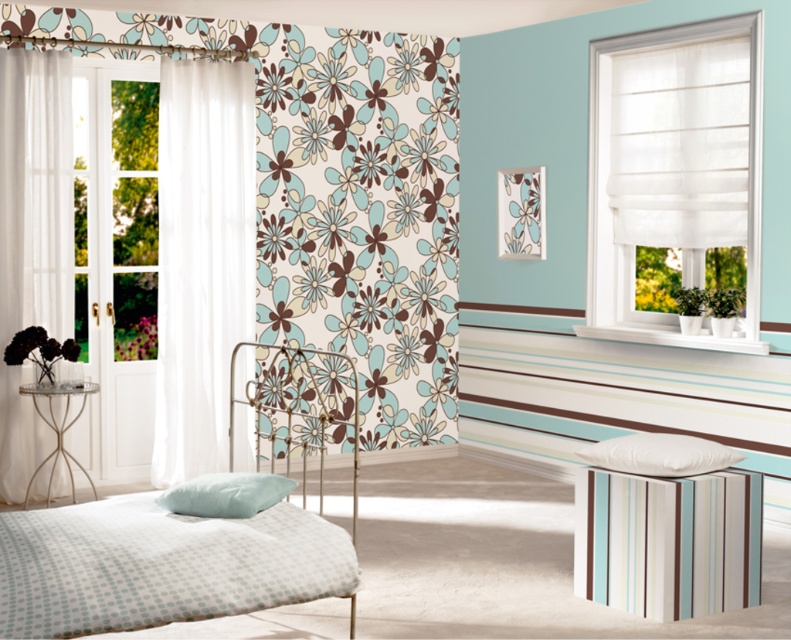
You are standing in the bedroom and want to place a new decorative item between the white dotted fabric bed at left and the white soft pillow at lower right. Based on their positions, where should you place the item so it is between them?

The white dotted fabric bed at left is in front of the white soft pillow at lower right, so placing the item between them would require positioning it in front of the white soft pillow at lower right but behind the white dotted fabric bed at left.

You are standing in the bedroom and want to hang a new painting that requires a tall hanging space. Which object between the white sheer curtain at right and the striped fabric stool at lower right would be a better choice for placing the painting above it?

The white sheer curtain at right is taller than the striped fabric stool at lower right, so placing the painting above the white sheer curtain at right would provide a more suitable tall space for the painting.

You are arranging flowers in the bedroom and want to place a vase between the white dotted fabric bed at left and the white soft pillow at lower right. Based on their positions, which object should the vase be closer to?

The white dotted fabric bed at left is positioned under the white soft pillow at lower right, so the vase should be placed closer to the white soft pillow at lower right since it is above the bed.